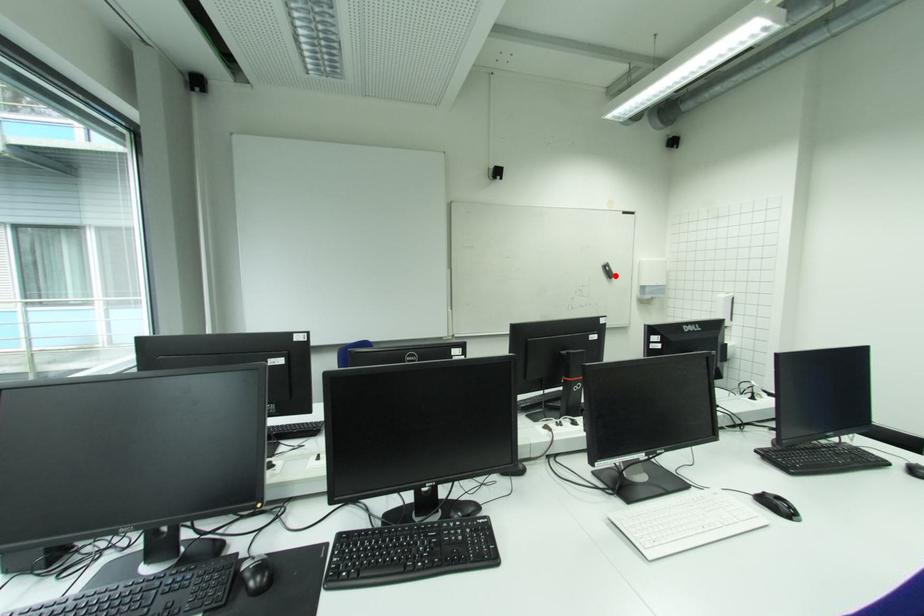
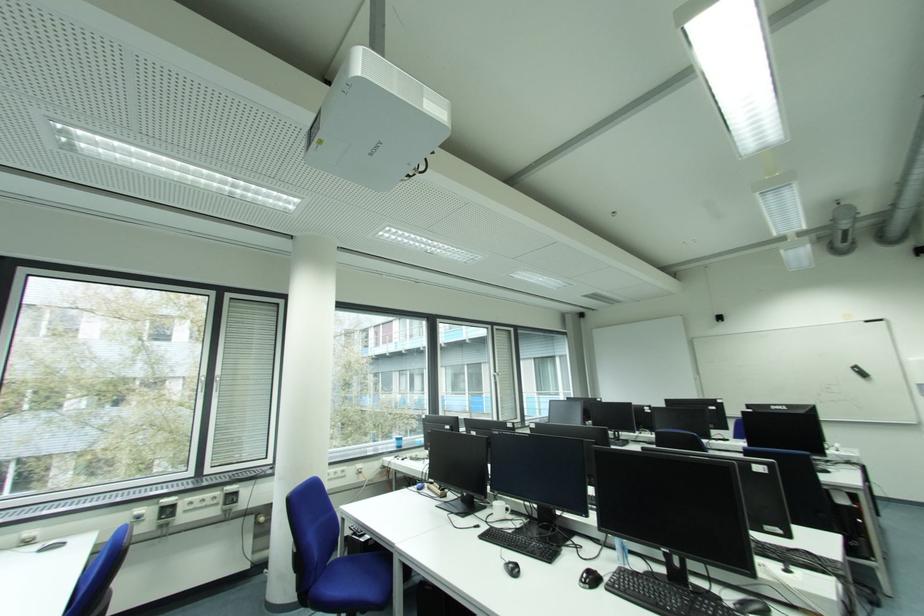
In the second image, find the point that corresponds to the highlighted location in the first image.

(869, 376)